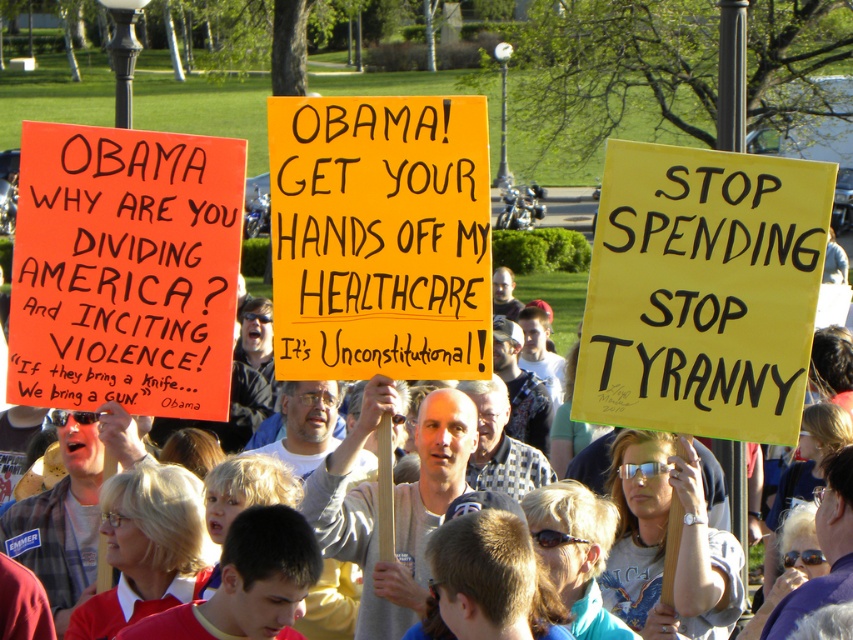
You are a journalist taking photos of the protest. You need to capture both the orange cardboard sign at left and the orange paper sign at center in a single frame. Based on their positions, which sign should you focus on first to ensure both are in the shot?

The orange cardboard sign at left is to the left of the orange paper sign at center, so you should focus on the orange cardboard sign at left first to ensure both signs are included in the frame.

You are a journalist trying to capture a photo of the orange cardboard sign at left and the orange paper sign at center. Which sign should you focus on first to ensure it appears larger in your photo?

The orange cardboard sign at left is closer to you than the orange paper sign at center, so focusing on it first will make it appear larger in your photo.